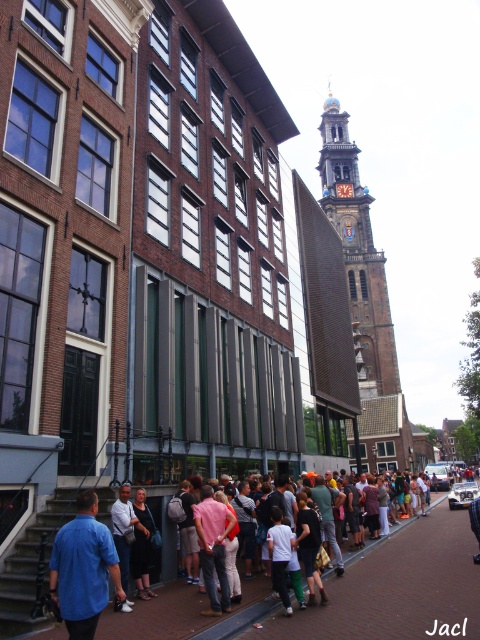
Question: Can you confirm if blue shirt at lower left is bigger than pink fabric shirt at center?

Choices:
 (A) yes
 (B) no

Answer: (A)

Question: Which of the following is the closest to the observer?

Choices:
 (A) (123, 547)
 (B) (245, 636)
 (C) (227, 522)

Answer: (B)

Question: Which object is closer to the camera taking this photo?

Choices:
 (A) brown brick clock tower at upper center
 (B) white shirt at center

Answer: (B)

Question: Among these points, which one is farthest from the camera?

Choices:
 (A) (96, 588)
 (B) (199, 538)

Answer: (B)

Question: Can you confirm if brown brick clock tower at upper center is positioned above white shirt at center?

Choices:
 (A) yes
 (B) no

Answer: (A)

Question: Can you confirm if brick pavement at lower center is smaller than pink fabric shirt at center?

Choices:
 (A) no
 (B) yes

Answer: (A)